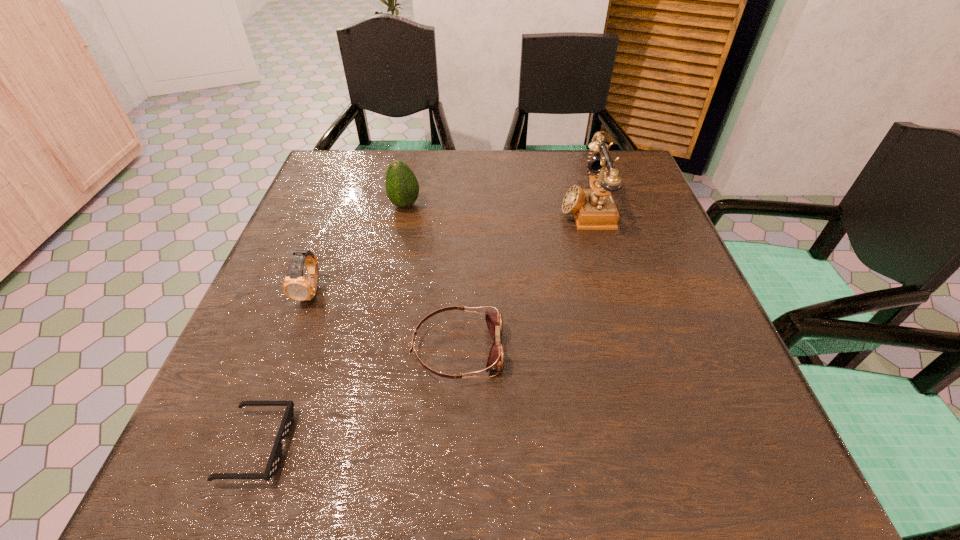
Find the location of a particular element. This screenshot has width=960, height=540. telephone is located at coordinates (594, 209).

The image size is (960, 540). What are the coordinates of `the rightmost object` in the screenshot? It's located at (594, 209).

Identify the location of avocado. click(402, 188).

Locate an element on the screen. the third object from right to left is located at coordinates (402, 188).

The image size is (960, 540). Identify the location of the third nearest object. (295, 286).

Locate an element on the screen. the third tallest object is located at coordinates (295, 286).

At what (x,y) coordinates should I click in order to perform the action: click on the second object from right to left. Please return your answer as a coordinate pair (x, y). This screenshot has height=540, width=960. Looking at the image, I should click on (495, 361).

Where is `the fourth tallest object`? The width and height of the screenshot is (960, 540). the fourth tallest object is located at coordinates (495, 361).

The width and height of the screenshot is (960, 540). In order to click on sunglasses in this screenshot , I will do coord(275,458).

Find the location of a particular element. the nearest object is located at coordinates (275, 458).